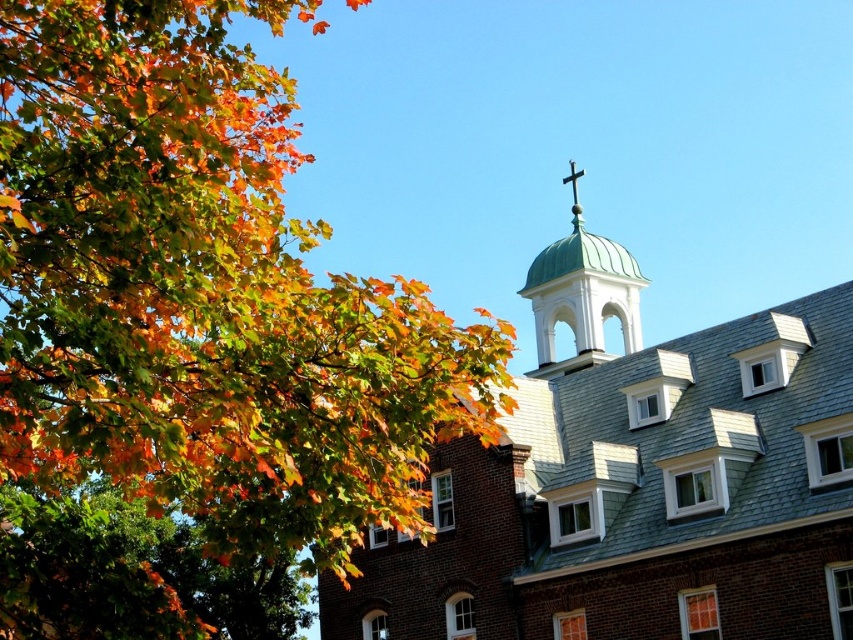
You are standing at the base of the tree with orange, yellow, and green leaves in the foreground of the church scene. You want to pick up autumn leaves located at point (202, 291). Is this point within the area covered by the autumn leaves?

The point (202, 291) is where the autumn leaves at upper left are located, so yes, the point is within the area covered by the autumn leaves.

You are standing in front of the church and see two points marked on the ground. The first point is at coordinate point [817,348], and the second point is at coordinate point [573,304]. Which point is closer to you?

Point [817,348] is in front of point [573,304], so the first point is closer to you.

You are an architect analyzing the building. From your perspective, which object occupies a larger area in the image, the autumn leaves at upper left or the green dome at upper center?

The autumn leaves at upper left is bigger than the green dome at upper center according to the description.